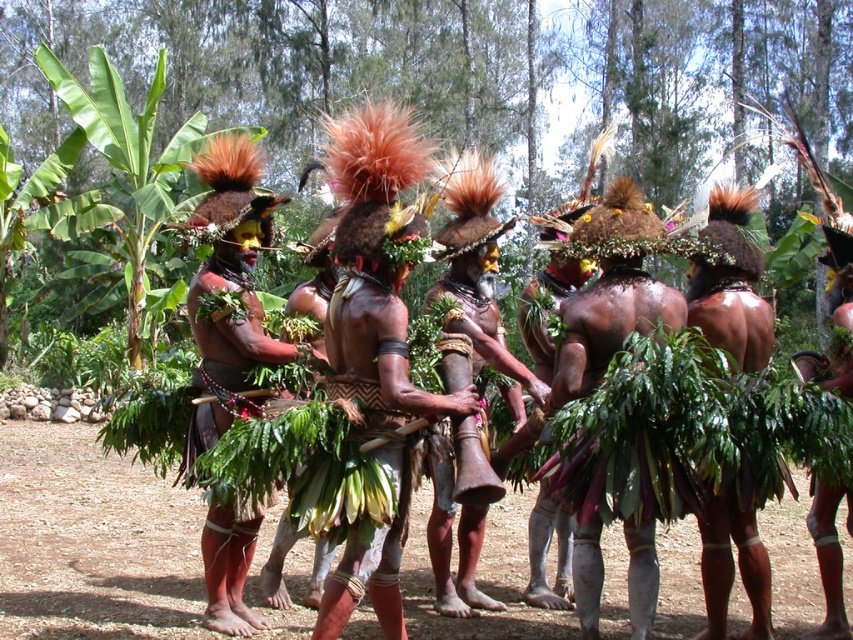
Question: Does brown textured leaf skirt at center appear on the right side of green leafy skirt at center?

Choices:
 (A) no
 (B) yes

Answer: (A)

Question: Among these objects, which one is farthest from the camera?

Choices:
 (A) brown textured leaf skirt at center
 (B) green leafy skirt at center

Answer: (B)

Question: Which point is closer to the camera?

Choices:
 (A) (634, 193)
 (B) (374, 388)

Answer: (B)

Question: Is the position of brown textured leaf skirt at center less distant than that of green leafy skirt at center?

Choices:
 (A) no
 (B) yes

Answer: (B)

Question: Does brown textured leaf skirt at center have a smaller size compared to green leafy skirt at center?

Choices:
 (A) no
 (B) yes

Answer: (A)